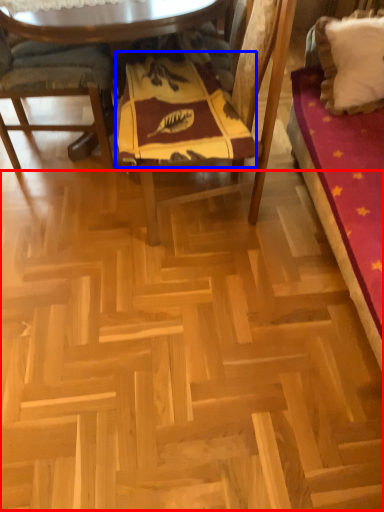
Question: Which object appears farthest to the camera in this image, plywood (highlighted by a red box) or blanket (highlighted by a blue box)?

Choices:
 (A) plywood
 (B) blanket

Answer: (B)